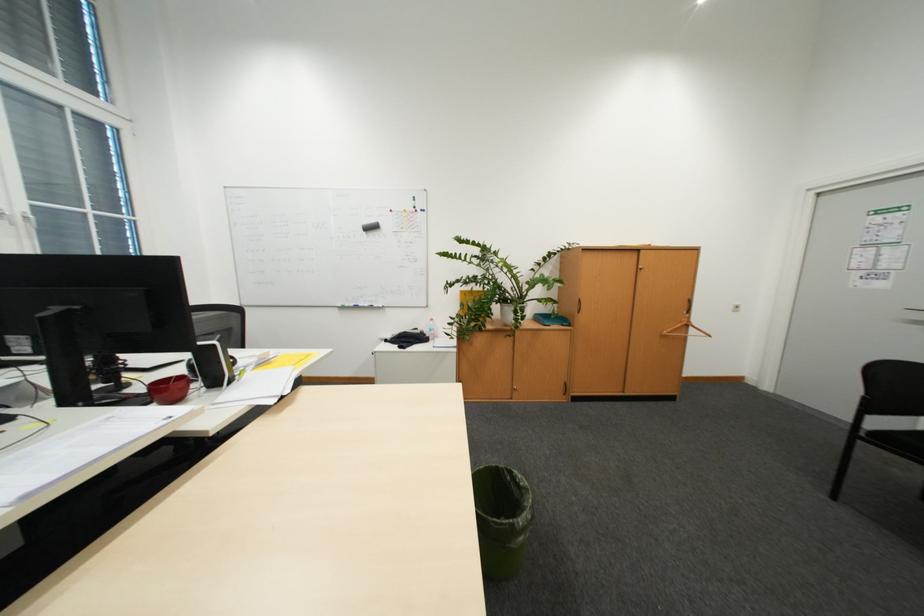
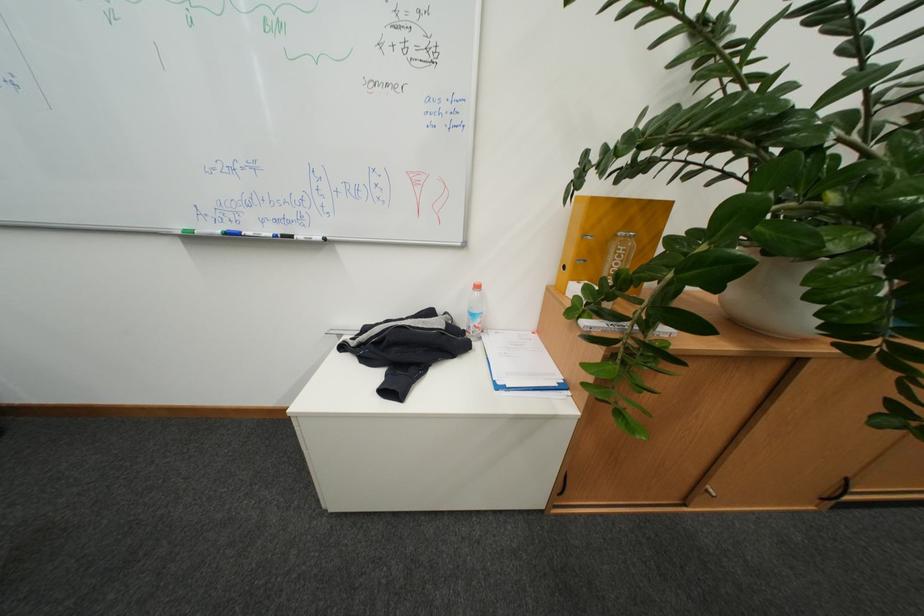
Question: Which direction would the cameraman need to move to produce the second image? Reply with the corresponding letter.

Choices:
 (A) Left
 (B) Right
 (C) Forward
 (D) Backward

Answer: (C)